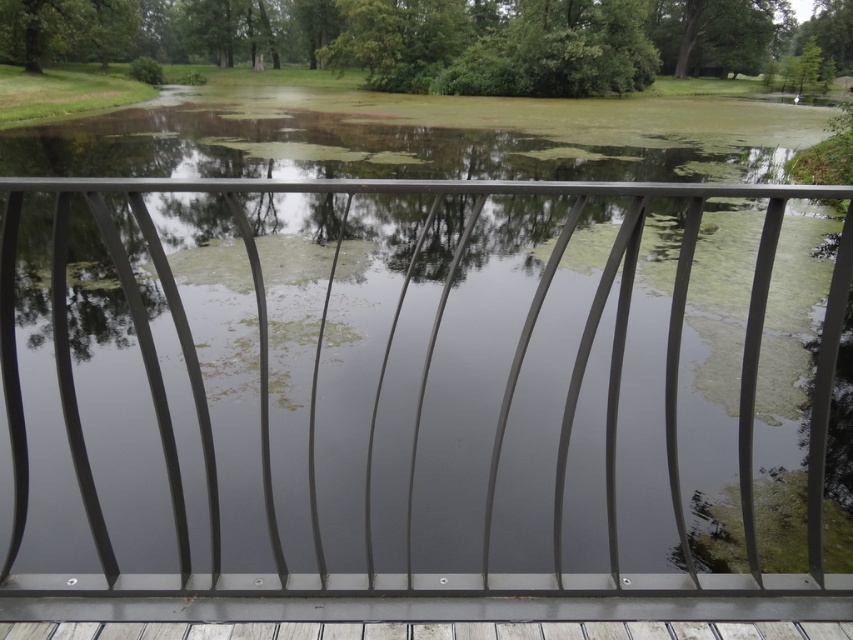
Between green leafy tree at upper center and green leafy tree at upper left, which one has more height?

With more height is green leafy tree at upper center.

Between green leafy tree at upper center and green leafy tree at upper left, which one is positioned lower?

green leafy tree at upper left is lower down.

Describe the element at coordinates (415, 38) in the screenshot. I see `green leafy tree at upper center` at that location.

The height and width of the screenshot is (640, 853). I want to click on green leafy tree at upper center, so click(x=415, y=38).